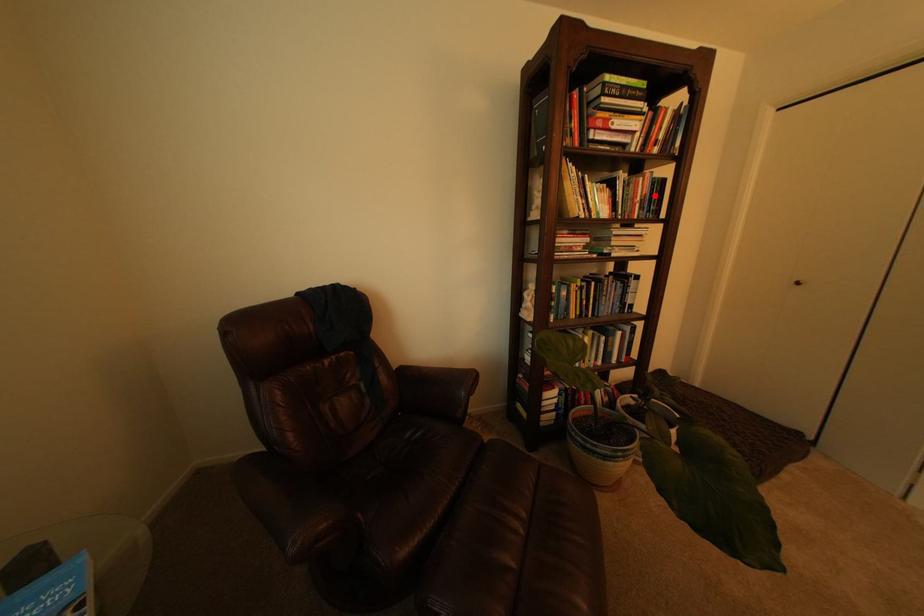
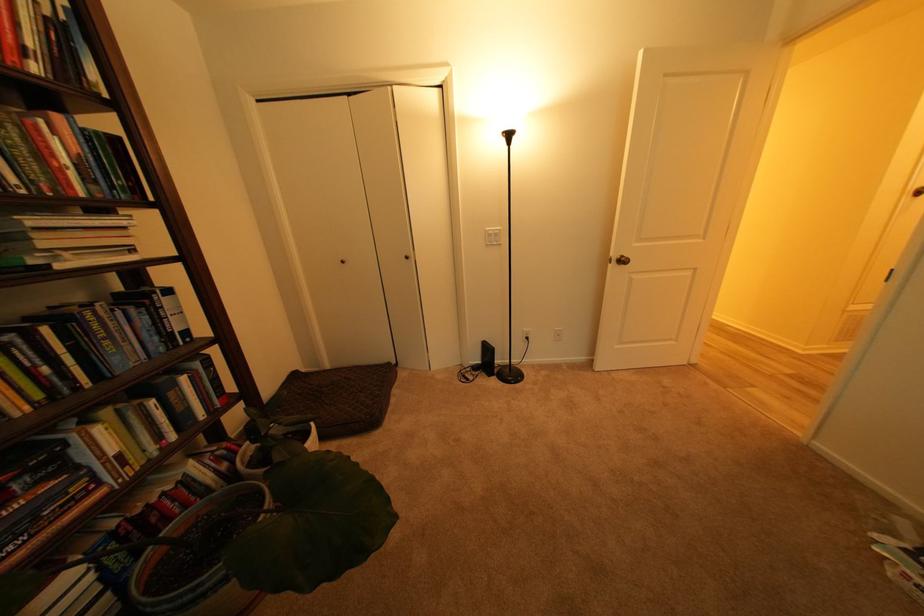
Question: I am providing you with two images of the same scene from different viewpoints. A red point is shown in image1. For the corresponding object point in image2, is it positioned nearer or farther from the camera?

Choices:
 (A) Nearer
 (B) Farther

Answer: (B)